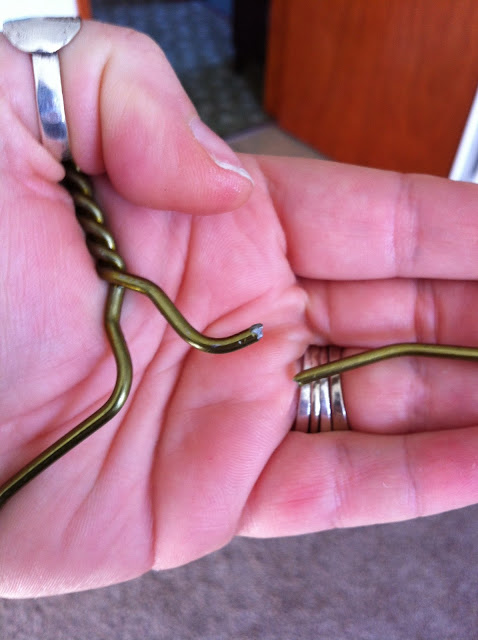
Find the location of a particular element. carpet is located at coordinates (199, 28).